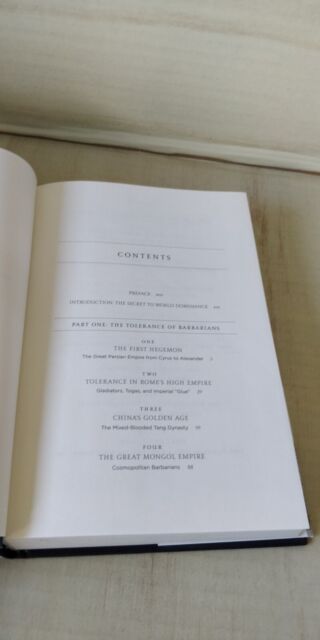
This screenshot has width=320, height=640. I want to click on wall, so click(278, 125).